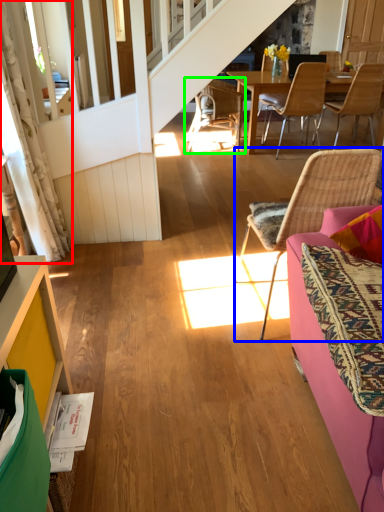
Question: Estimate the real-world distances between objects in this image. Which object is closer to curtain (highlighted by a red box), chair (highlighted by a blue box) or chair (highlighted by a green box)?

Choices:
 (A) chair
 (B) chair

Answer: (A)